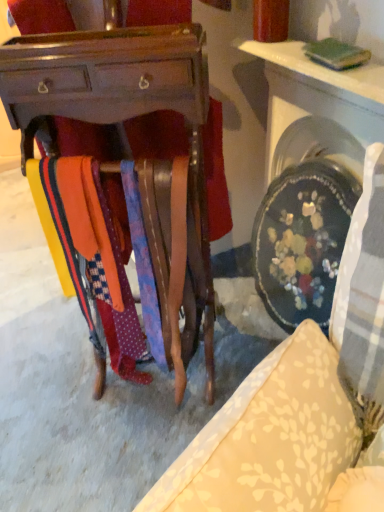
Identify the location of free space to the left of wooden desk at center. This screenshot has height=512, width=384. (41, 355).